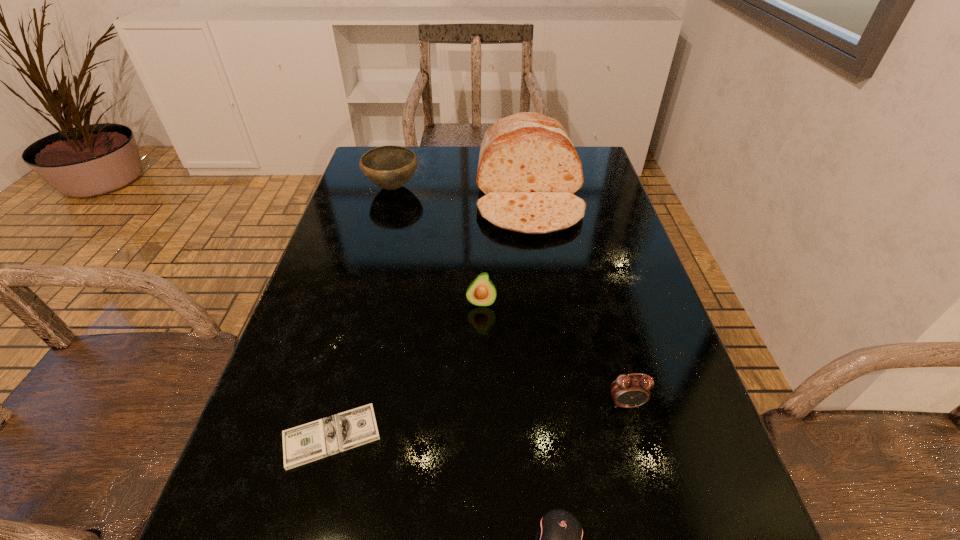
The width and height of the screenshot is (960, 540). Find the location of `free space at the right edge of the desktop`. free space at the right edge of the desktop is located at coordinates (637, 292).

You are a GUI agent. You are given a task and a screenshot of the screen. Output one action in this format:
    pyautogui.click(x=<x>, y=<y>)
    Task: Click on the vacant space that is in between the alarm clock and the dollar
    
    Given the screenshot: What is the action you would take?
    pyautogui.click(x=479, y=420)

Identify the location of vacant area between the avocado and the dollar. (406, 369).

Find the location of a particular element. vacant region between the alarm clock and the fourth nearest object is located at coordinates (554, 353).

In order to click on vacant region between the tallest object and the bowl in this screenshot , I will do (461, 192).

The image size is (960, 540). Identify the location of vacant area that lies between the avocado and the shortest object. (406, 369).

Find the location of `vacant space that's between the bowl and the avocado`. vacant space that's between the bowl and the avocado is located at coordinates (437, 245).

Select which object appears as the third closest to the avocado. Please provide its 2D coordinates. Your answer should be formatted as a tuple, i.e. [(x, y)], where the tuple contains the x and y coordinates of a point satisfying the conditions above.

[(628, 391)]

Where is `the second closest object to the bowl`? the second closest object to the bowl is located at coordinates (481, 292).